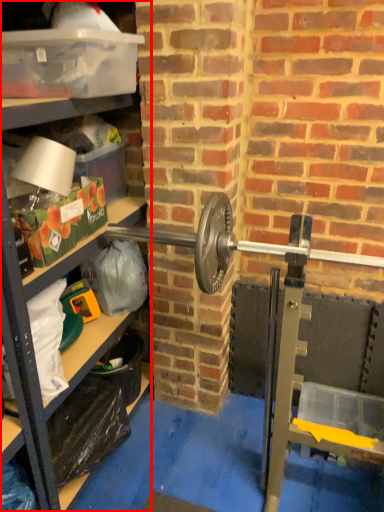
Question: Considering the relative positions of shelf (annotated by the red box) and box in the image provided, where is shelf (annotated by the red box) located with respect to the staircase?

Choices:
 (A) right
 (B) left

Answer: (B)